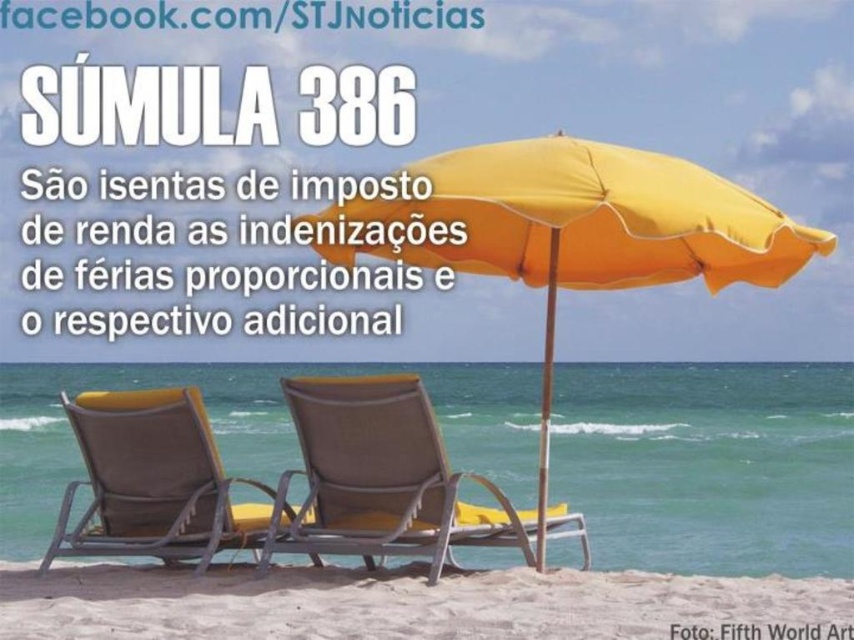
Does textured fabric lounge chair at center appear over textured fabric beach chair at center?

Actually, textured fabric lounge chair at center is below textured fabric beach chair at center.

Who is positioned more to the left, textured fabric lounge chair at center or textured fabric beach chair at center?

textured fabric beach chair at center

This screenshot has width=854, height=640. What do you see at coordinates (381, 477) in the screenshot? I see `textured fabric lounge chair at center` at bounding box center [381, 477].

Where is `textured fabric lounge chair at center`? Image resolution: width=854 pixels, height=640 pixels. textured fabric lounge chair at center is located at coordinates (381, 477).

Is point (683, 216) less distant than point (246, 636)?

That is False.

From the picture: Is yellow fabric umbrella at center further to the viewer compared to white sandy beach at lower center?

Yes, it is.

Is point (419, 192) farther from camera compared to point (594, 605)?

Yes, point (419, 192) is farther from viewer.

This screenshot has width=854, height=640. I want to click on yellow fabric umbrella at center, so click(566, 228).

Is point (578, 192) closer to camera compared to point (98, 451)?

Yes, it is.

Is point (515, 243) farther from viewer compared to point (100, 509)?

Yes, it is.

At what (x,y) coordinates should I click in order to perform the action: click on yellow fabric umbrella at center. Please return your answer as a coordinate pair (x, y). Looking at the image, I should click on (566, 228).